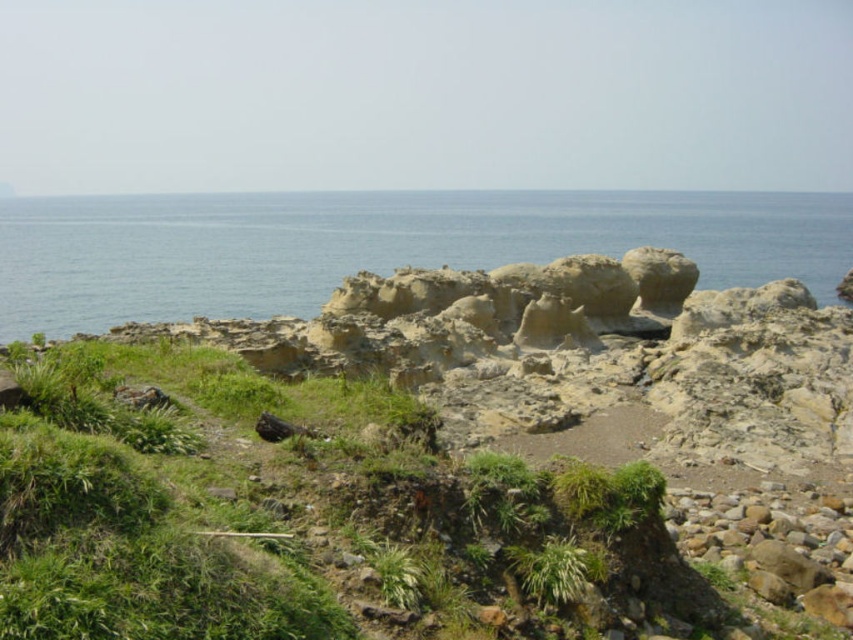
Does green grassy at center have a lesser height compared to blue water at center?

Correct, green grassy at center is not as tall as blue water at center.

How much distance is there between green grassy at center and blue water at center?

138.46 meters

The height and width of the screenshot is (640, 853). What do you see at coordinates (315, 516) in the screenshot?
I see `green grassy at center` at bounding box center [315, 516].

Locate an element on the screen. green grassy at center is located at coordinates (315, 516).